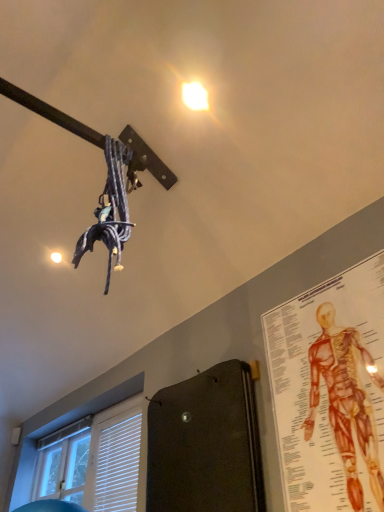
Question: In terms of width, does white glossy droplight at upper center look wider or thinner when compared to anatomical chart at upper right?

Choices:
 (A) thin
 (B) wide

Answer: (B)

Question: From the image's perspective, is white glossy droplight at upper center located above or below anatomical chart at upper right?

Choices:
 (A) above
 (B) below

Answer: (A)

Question: Estimate the real-world distances between objects in this image. Which object is closer to the anatomical chart at upper right?

Choices:
 (A) white plastic blinds at lower left
 (B) white glossy droplight at upper center

Answer: (B)

Question: Which object is positioned farthest from the white glossy droplight at upper center?

Choices:
 (A) white plastic blinds at lower left
 (B) anatomical chart at upper right

Answer: (A)